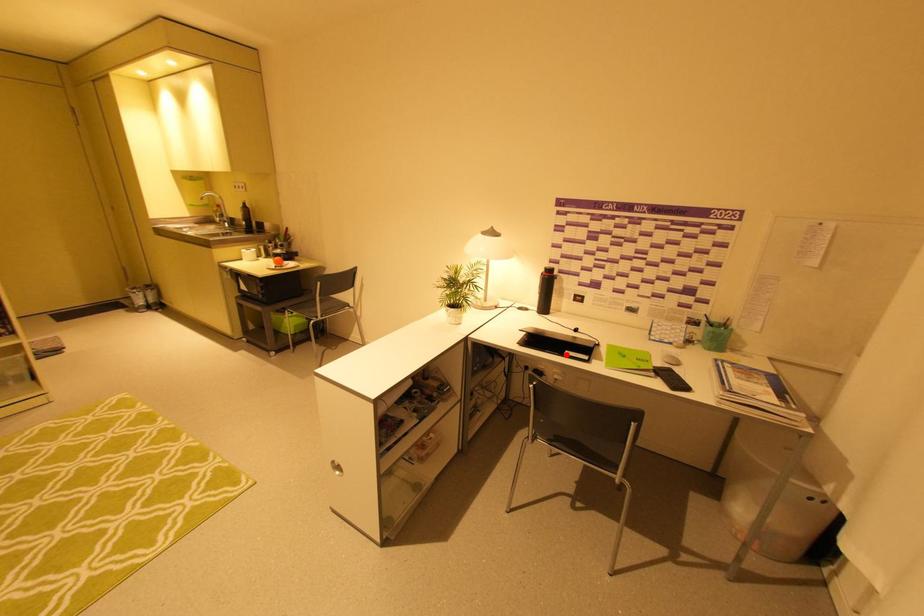
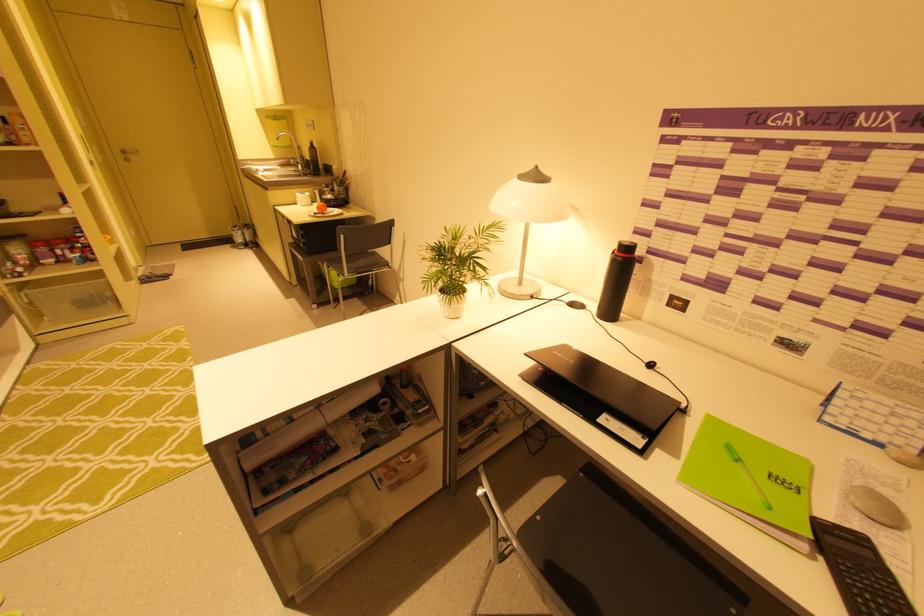
Find the pixel in the second image that matches the highlighted location in the first image.

(596, 419)